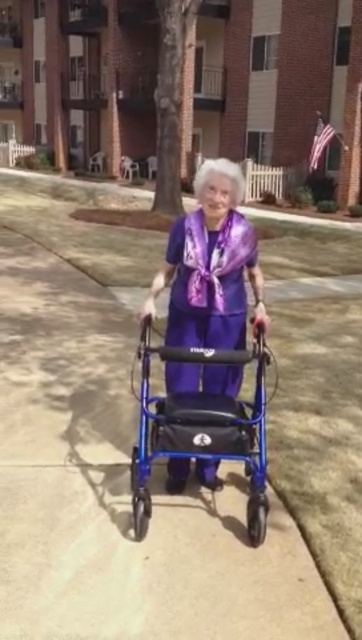
Question: Which object is the closest to the blue metallic walker at center?

Choices:
 (A) purple fabric walker at center
 (B) smooth concrete sidewalk at center

Answer: (A)

Question: Can you confirm if smooth concrete sidewalk at center is positioned above purple fabric walker at center?

Choices:
 (A) no
 (B) yes

Answer: (B)

Question: Can you confirm if smooth concrete sidewalk at center is smaller than blue metallic walker at center?

Choices:
 (A) no
 (B) yes

Answer: (A)

Question: Where is smooth concrete sidewalk at center located in relation to purple fabric walker at center in the image?

Choices:
 (A) right
 (B) left

Answer: (B)

Question: Which object is the closest to the blue metallic walker at center?

Choices:
 (A) purple fabric walker at center
 (B) smooth concrete sidewalk at center

Answer: (A)

Question: Which of these objects is positioned farthest from the blue metallic walker at center?

Choices:
 (A) purple fabric walker at center
 (B) smooth concrete sidewalk at center

Answer: (B)